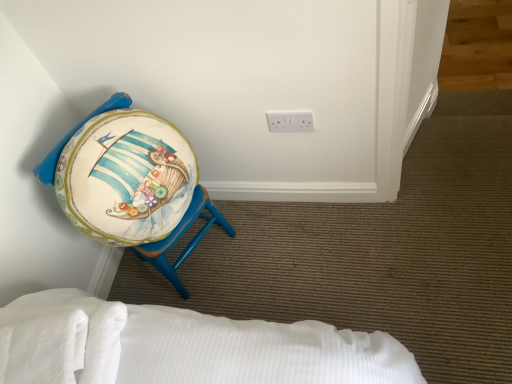
Question: Which direction should I rotate to look at white plastic electric outlet at upper center?

Choices:
 (A) left
 (B) right

Answer: (B)

Question: From the image's perspective, is white plastic electric outlet at upper center above matte painted stool at left?

Choices:
 (A) yes
 (B) no

Answer: (A)

Question: From the image's perspective, is white plastic electric outlet at upper center below matte painted stool at left?

Choices:
 (A) yes
 (B) no

Answer: (B)

Question: Is white plastic electric outlet at upper center located outside matte painted stool at left?

Choices:
 (A) yes
 (B) no

Answer: (A)

Question: Considering the relative sizes of white plastic electric outlet at upper center and matte painted stool at left in the image provided, is white plastic electric outlet at upper center taller than matte painted stool at left?

Choices:
 (A) no
 (B) yes

Answer: (A)

Question: Is matte painted stool at left at the back of white plastic electric outlet at upper center?

Choices:
 (A) yes
 (B) no

Answer: (B)

Question: Is white plastic electric outlet at upper center far from matte painted stool at left?

Choices:
 (A) yes
 (B) no

Answer: (B)

Question: Is matte painted stool at left outside of white soft towel at lower left?

Choices:
 (A) yes
 (B) no

Answer: (A)

Question: Is matte painted stool at left at the left side of white soft towel at lower left?

Choices:
 (A) yes
 (B) no

Answer: (B)

Question: Does matte painted stool at left come behind white soft towel at lower left?

Choices:
 (A) no
 (B) yes

Answer: (B)

Question: Considering the relative sizes of matte painted stool at left and white soft towel at lower left in the image provided, is matte painted stool at left bigger than white soft towel at lower left?

Choices:
 (A) yes
 (B) no

Answer: (A)

Question: Is matte painted stool at left wider than white soft towel at lower left?

Choices:
 (A) yes
 (B) no

Answer: (A)

Question: Considering the relative sizes of matte painted stool at left and white soft towel at lower left in the image provided, is matte painted stool at left taller than white soft towel at lower left?

Choices:
 (A) yes
 (B) no

Answer: (A)

Question: Is matte painted stool at left positioned with its back to white plastic electric outlet at upper center?

Choices:
 (A) no
 (B) yes

Answer: (A)